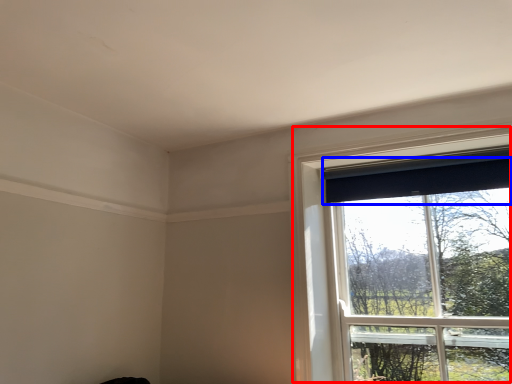
Question: Which point is further to the camera, window (highlighted by a red box) or curtain (highlighted by a blue box)?

Choices:
 (A) window
 (B) curtain

Answer: (B)